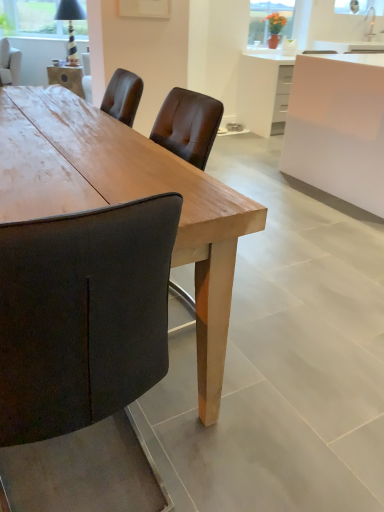
The image size is (384, 512). What do you see at coordinates (338, 127) in the screenshot?
I see `white glossy cabinet at upper right` at bounding box center [338, 127].

Image resolution: width=384 pixels, height=512 pixels. I want to click on white glossy cabinet at upper right, so click(338, 127).

Measure the distance between wooden table at center and camera.

wooden table at center and camera are 86.30 centimeters apart.

This screenshot has width=384, height=512. What are the coordinates of `wooden table at center` in the screenshot? It's located at (126, 200).

Locate an element on the screen. white glossy cabinet at upper right is located at coordinates (338, 127).

Considering the sizes of white glossy cabinet at upper right and wooden table at center in the image, is white glossy cabinet at upper right taller or shorter than wooden table at center?

In the image, white glossy cabinet at upper right appears to be taller than wooden table at center.

Are white glossy cabinet at upper right and wooden table at center located far from each other?

white glossy cabinet at upper right is positioned a significant distance from wooden table at center.

From the image's perspective, relative to wooden table at center, is white glossy cabinet at upper right above or below?

Based on their image positions, white glossy cabinet at upper right is located above wooden table at center.

Find the location of a particular element. This screenshot has height=512, width=384. cabinetry that is on the right side of wooden table at center is located at coordinates (338, 127).

Is dark brown leather chair at upper left facing towards white glossy cabinet at upper right?

No, dark brown leather chair at upper left is not aimed at white glossy cabinet at upper right.

Does dark brown leather chair at upper left have a lesser width compared to white glossy cabinet at upper right?

Correct, the width of dark brown leather chair at upper left is less than that of white glossy cabinet at upper right.

Can you see dark brown leather chair at upper left touching white glossy cabinet at upper right?

No, dark brown leather chair at upper left is not with white glossy cabinet at upper right.

Relative to white glossy cabinet at upper right, is dark brown leather chair at upper left in front or behind?

Clearly, dark brown leather chair at upper left is behind white glossy cabinet at upper right.

Is white glossy cabinet at upper right placed right next to white glossy cabinet at upper right?

No, white glossy cabinet at upper right is not next to white glossy cabinet at upper right.

Does white glossy cabinet at upper right have a smaller size compared to white glossy cabinet at upper right?

No.

Can you confirm if white glossy cabinet at upper right is thinner than white glossy cabinet at upper right?

In fact, white glossy cabinet at upper right might be wider than white glossy cabinet at upper right.

Between point (359, 137) and point (280, 96), which one is positioned in front?

The point (359, 137) is closer.

From the image's perspective, would you say white glossy cabinet at upper right is shown under wooden table at center?

No, from the image's perspective, white glossy cabinet at upper right is not beneath wooden table at center.

How distant is white glossy cabinet at upper right from wooden table at center?

10.62 feet.

Considering the relative sizes of white glossy cabinet at upper right and wooden table at center in the image provided, is white glossy cabinet at upper right taller than wooden table at center?

Yes.

Is wooden table at center thinner than matte glass vase at upper center?

In fact, wooden table at center might be wider than matte glass vase at upper center.

The image size is (384, 512). I want to click on window screen above the wooden table at center (from a real-world perspective), so click(x=270, y=20).

From a real-world perspective, is wooden table at center physically above matte glass vase at upper center?

Incorrect, from a real-world perspective, wooden table at center is lower than matte glass vase at upper center.

Can you tell me how much wooden table at center and matte glass vase at upper center differ in facing direction?

1.58 degrees.

Would you say dark brown leather chair at upper left is outside white glossy cabinet at upper right?

dark brown leather chair at upper left lies outside white glossy cabinet at upper right's area.

From a real-world perspective, is dark brown leather chair at upper left beneath white glossy cabinet at upper right?

No.

Does point (16, 80) appear closer or farther from the camera than point (338, 172)?

Point (16, 80) is positioned farther from the camera compared to point (338, 172).

Is white glossy cabinet at upper right further to camera compared to dark brown leather chair at upper left?

No, it is in front of dark brown leather chair at upper left.

Where is `cabinetry in front of the dark brown leather chair at upper left`? The height and width of the screenshot is (512, 384). cabinetry in front of the dark brown leather chair at upper left is located at coordinates (338, 127).

Is white glossy cabinet at upper right aimed at dark brown leather chair at upper left?

No.

How distant is white glossy cabinet at upper right from dark brown leather chair at upper left?

white glossy cabinet at upper right and dark brown leather chair at upper left are 4.93 meters apart from each other.

Locate an element on the screen. The image size is (384, 512). cabinetry lying behind the wooden table at center is located at coordinates (338, 127).

Locate an element on the screen. The width and height of the screenshot is (384, 512). counter below the dark brown leather chair at upper left (from a real-world perspective) is located at coordinates (264, 91).

Looking at the image, which one is located closer to matte glass vase at upper center, dark brown leather chair at upper left or wooden table at center?

wooden table at center is closer to matte glass vase at upper center.

Which object lies further to the anchor point white glossy cabinet at upper right, wooden table at center or dark brown leather chair at upper left?

Based on the image, dark brown leather chair at upper left appears to be further to white glossy cabinet at upper right.

Estimate the real-world distances between objects in this image. Which object is further from white glossy cabinet at upper right, white glossy cabinet at upper right or wooden table at center?

The object further to white glossy cabinet at upper right is wooden table at center.

Looking at the image, which one is located closer to white glossy cabinet at upper right, matte glass vase at upper center or white glossy cabinet at upper right?

Based on the image, matte glass vase at upper center appears to be nearer to white glossy cabinet at upper right.

When comparing their distances from white glossy cabinet at upper right, does dark brown leather chair at upper left or matte glass vase at upper center seem further?

dark brown leather chair at upper left.

When comparing their distances from matte glass vase at upper center, does wooden table at center or white glossy cabinet at upper right seem closer?

white glossy cabinet at upper right is positioned closer to the anchor matte glass vase at upper center.

Looking at the image, which one is located closer to dark brown leather chair at upper left, white glossy cabinet at upper right or matte glass vase at upper center?

The object closer to dark brown leather chair at upper left is matte glass vase at upper center.

In the scene shown: Estimate the real-world distances between objects in this image. Which object is closer to wooden table at center, matte glass vase at upper center or white glossy cabinet at upper right?

white glossy cabinet at upper right.

Identify the location of counter between wooden table at center and matte glass vase at upper center from front to back. (264, 91).

The width and height of the screenshot is (384, 512). I want to click on counter located between white glossy cabinet at upper right and matte glass vase at upper center in the depth direction, so click(264, 91).

Locate an element on the screen. The image size is (384, 512). counter between dark brown leather chair at upper left and white glossy cabinet at upper right in the horizontal direction is located at coordinates (264, 91).

At what (x,y) coordinates should I click in order to perform the action: click on window screen between wooden table at center and dark brown leather chair at upper left along the z-axis. Please return your answer as a coordinate pair (x, y). Looking at the image, I should click on (270, 20).